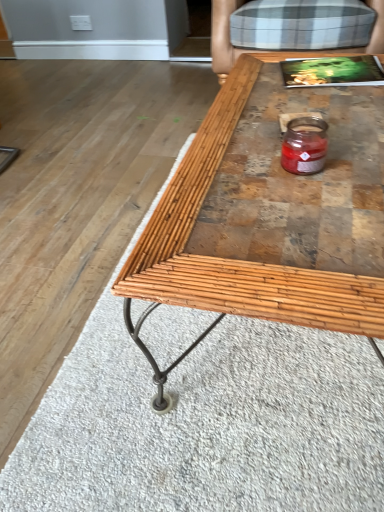
Question: In terms of width, does bamboo wood coffee table at center look wider or thinner when compared to translucent glass candle at center?

Choices:
 (A) thin
 (B) wide

Answer: (B)

Question: From the image's perspective, is bamboo wood coffee table at center positioned above or below translucent glass candle at center?

Choices:
 (A) above
 (B) below

Answer: (B)

Question: Which is farther from the bamboo wood coffee table at center?

Choices:
 (A) translucent glass candle at center
 (B) plaid fabric armchair at upper right

Answer: (B)

Question: Considering the real-world distances, which object is farthest from the bamboo wood coffee table at center?

Choices:
 (A) plaid fabric armchair at upper right
 (B) translucent glass candle at center

Answer: (A)